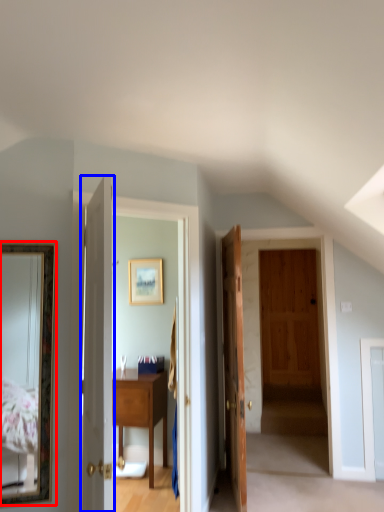
Question: Which object is further to the camera taking this photo, mirror (highlighted by a red box) or door (highlighted by a blue box)?

Choices:
 (A) mirror
 (B) door

Answer: (A)